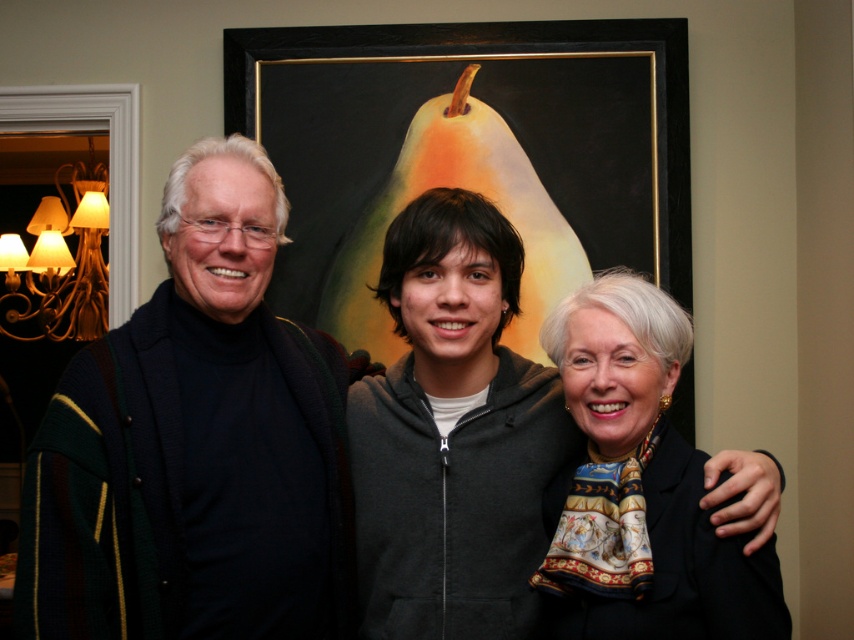
You are a delivery robot that is 1 meter wide. You need to move from the dark blue turtleneck sweater at left to the black glossy picture frame at upper center. Can you pass through the space between them?

The distance between the dark blue turtleneck sweater at left and the black glossy picture frame at upper center is 1.16 meters. Since the robot is 1 meter wide, it can pass through the space between them as the distance is greater than the robot width.

You are a photographer trying to capture a clear shot of the silky black scarf at center. However, the black glossy picture frame at upper center is blocking your view. Can you adjust your camera angle to avoid the frame while still keeping the scarf in the shot?

The black glossy picture frame at upper center is positioned over the silky black scarf at center, so tilting the camera downward slightly would allow you to avoid the frame while keeping the scarf in the shot.

You are standing in front of the group and want to hand a gift to the person wearing the matte black sweater at center without touching the dark blue turtleneck sweater at left. Is this possible?

The matte black sweater at center is further to the viewer than the dark blue turtleneck sweater at left, so yes, you can hand the gift to the matte black sweater at center without touching the dark blue turtleneck sweater at left since it is closer to you.